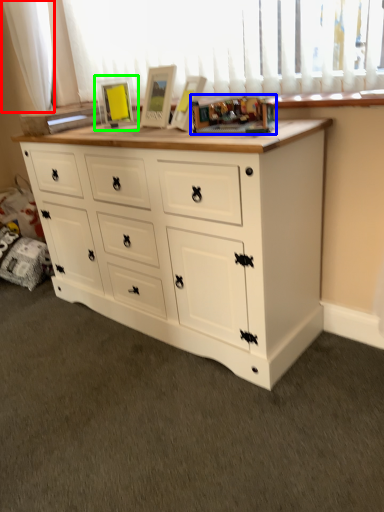
Question: Which object is positioned farthest from curtain (highlighted by a red box)? Select from toy (highlighted by a blue box) and picture frame (highlighted by a green box).

Choices:
 (A) toy
 (B) picture frame

Answer: (A)